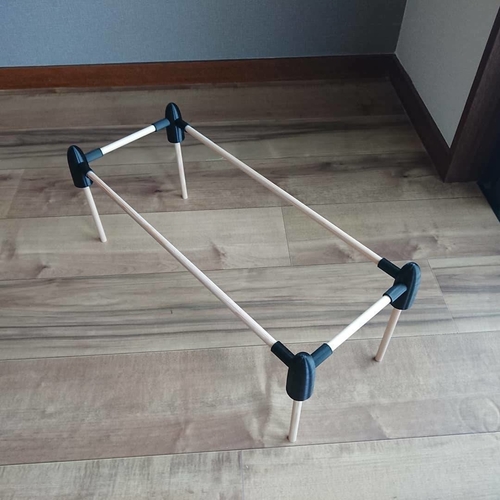
Find the location of `wood plank`. wood plank is located at coordinates (429, 464).